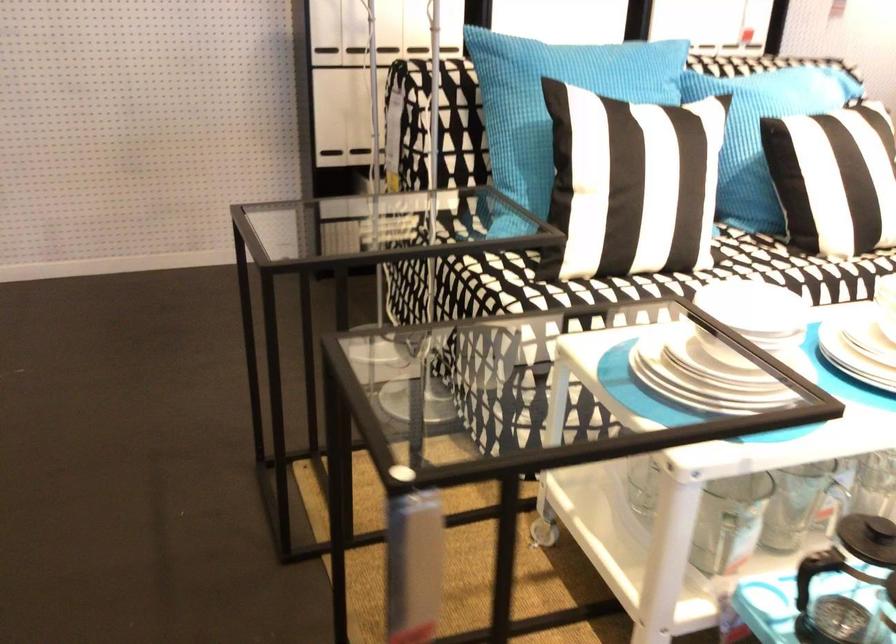
Where would you lift the white ceramic bowl? Please return your answer as a coordinate pair (x, y).

(757, 310)